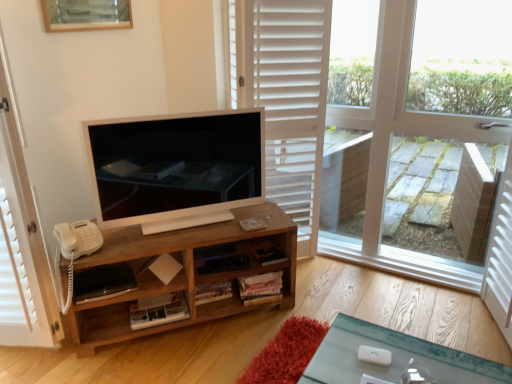
Locate an element on the screen. Image resolution: width=512 pixels, height=384 pixels. vacant area situated below satin white television at center (from a real-world perspective) is located at coordinates (169, 221).